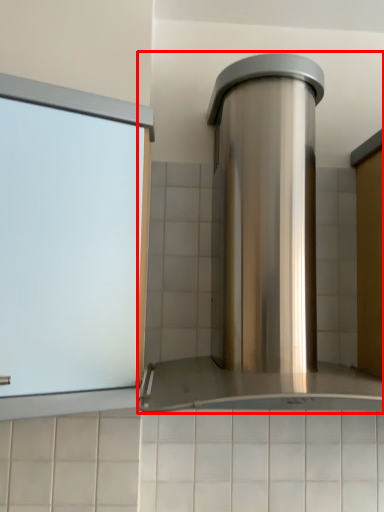
Question: Observing the image, what is the correct spatial positioning of home appliance (annotated by the red box) in reference to window?

Choices:
 (A) left
 (B) right

Answer: (B)